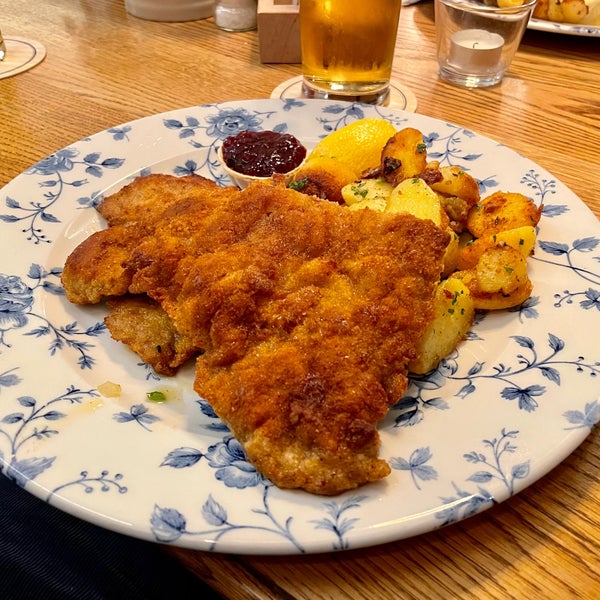
I want to click on white plate, so pos(138,450).